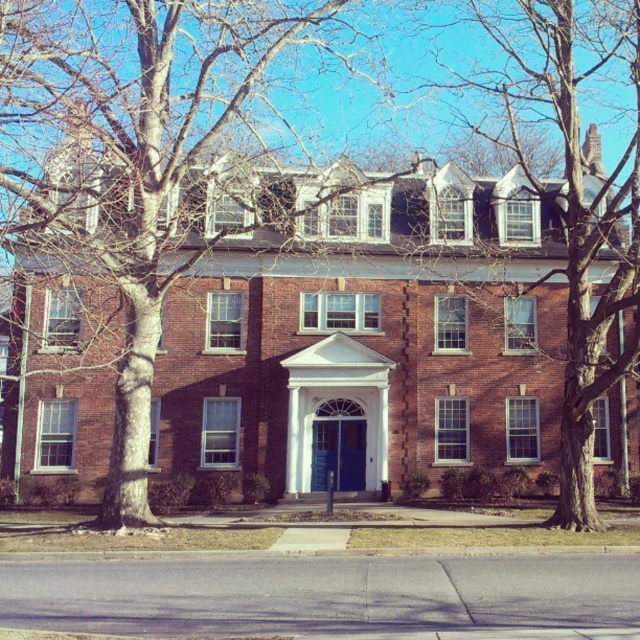
Between bare bark tree at center and bare wood tree at upper right, which one appears on the left side from the viewer's perspective?

Positioned to the left is bare bark tree at center.

Is bare bark tree at center to the left of bare wood tree at upper right from the viewer's perspective?

Indeed, bare bark tree at center is positioned on the left side of bare wood tree at upper right.

Is point (282, 214) in front of point (596, 364)?

That is False.

Where is `bare bark tree at center`? The image size is (640, 640). bare bark tree at center is located at coordinates (136, 161).